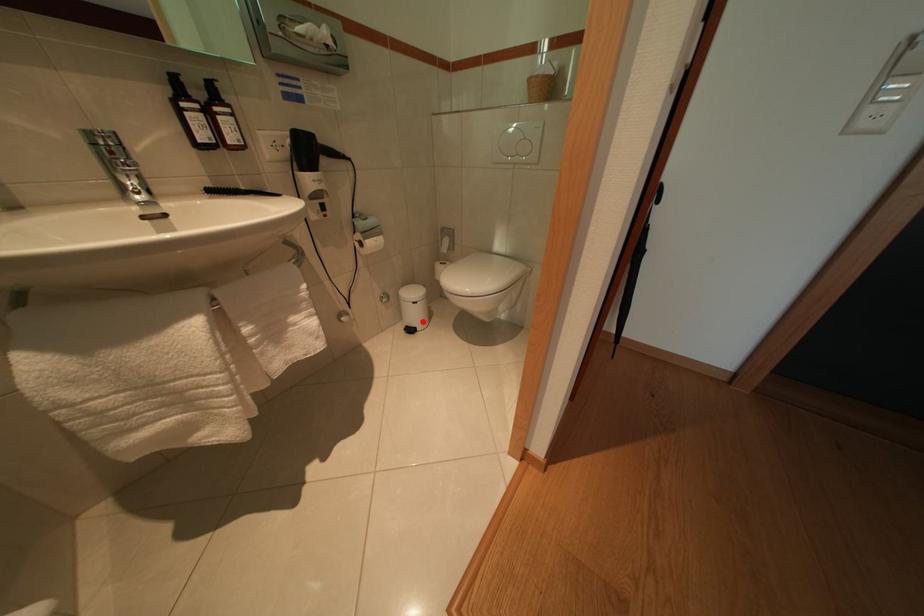
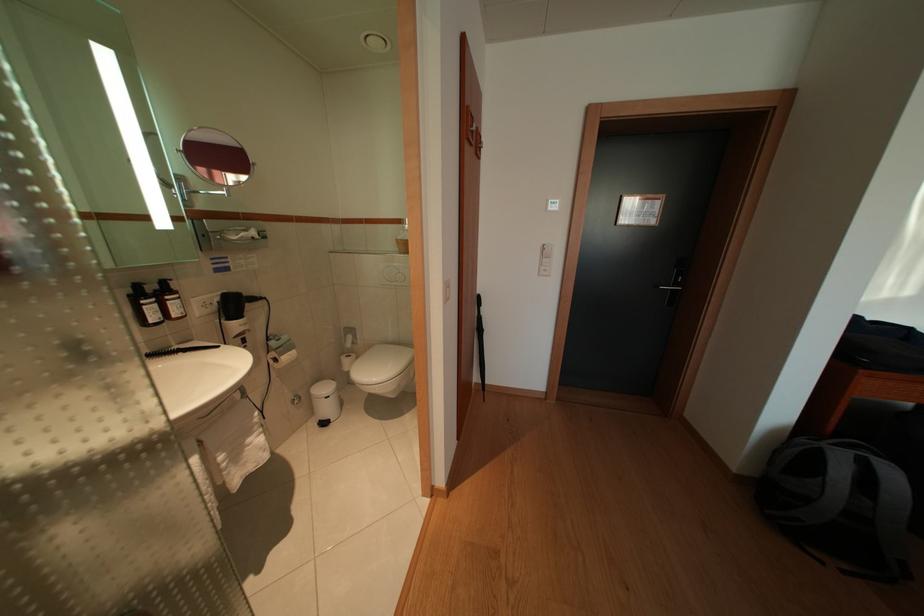
The point at the highlighted location is marked in the first image. Where is the corresponding point in the second image?

(335, 415)